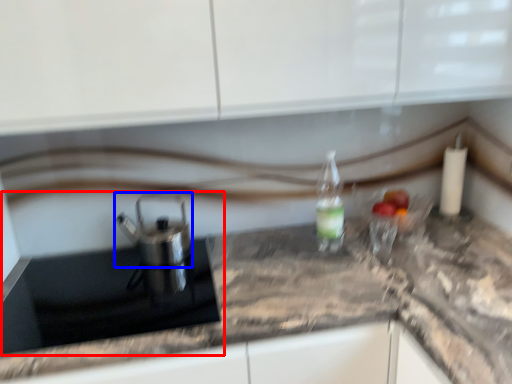
Question: Among these objects, which one is nearest to the camera, sink (highlighted by a red box) or tea pot (highlighted by a blue box)?

Choices:
 (A) sink
 (B) tea pot

Answer: (A)